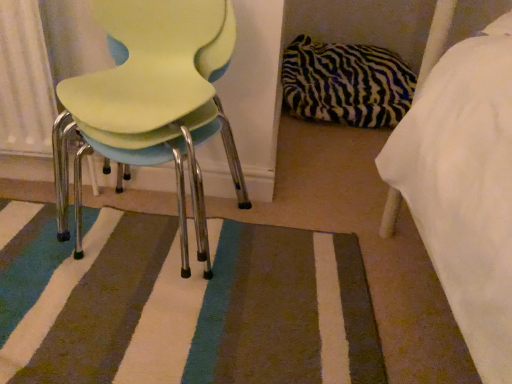
Question: From their relative heights in the image, would you say zebra-patterned pillow at center-right is taller or shorter than matte plastic chair at left?

Choices:
 (A) short
 (B) tall

Answer: (A)

Question: Considering the relative positions of zebra-patterned pillow at center-right and matte plastic chair at left in the image provided, is zebra-patterned pillow at center-right to the left or to the right of matte plastic chair at left?

Choices:
 (A) right
 (B) left

Answer: (A)

Question: Estimate the real-world distances between objects in this image. Which object is farther from the striped carpet at center?

Choices:
 (A) zebra-patterned pillow at center-right
 (B) matte plastic chair at left

Answer: (A)

Question: Considering the real-world distances, which object is farthest from the striped carpet at center?

Choices:
 (A) matte plastic chair at left
 (B) zebra-patterned pillow at center-right

Answer: (B)